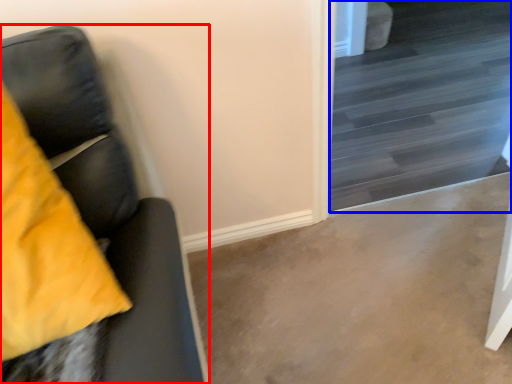
Question: Which object is closer to the camera taking this photo, furniture (highlighted by a red box) or stairwell (highlighted by a blue box)?

Choices:
 (A) furniture
 (B) stairwell

Answer: (A)